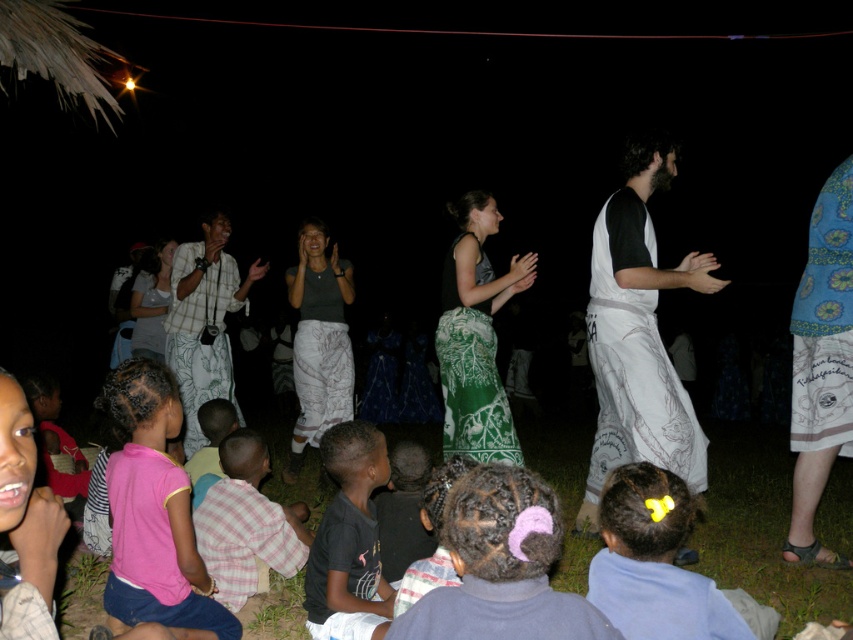
Question: Estimate the real-world distances between objects in this image. Which object is farther from the plaid fabric shirt at center?

Choices:
 (A) white cotton skirt at right
 (B) black cotton shirt at lower center

Answer: (A)

Question: Which object is positioned closest to the white cotton skirt at right?

Choices:
 (A) plaid fabric shirt at center
 (B) pink fabric at lower left
 (C) black cotton shirt at lower center
 (D) pink plaid shirt at lower left

Answer: (C)

Question: Is white cotton skirt at right smaller than pink fabric at lower left?

Choices:
 (A) no
 (B) yes

Answer: (A)

Question: Among these objects, which one is nearest to the camera?

Choices:
 (A) pink fabric at lower left
 (B) black cotton shirt at lower center

Answer: (B)

Question: Does black cotton shirt at lower center have a greater width compared to plaid fabric shirt at center?

Choices:
 (A) yes
 (B) no

Answer: (B)

Question: Does black cotton shirt at lower center appear under pink plaid shirt at lower left?

Choices:
 (A) yes
 (B) no

Answer: (B)